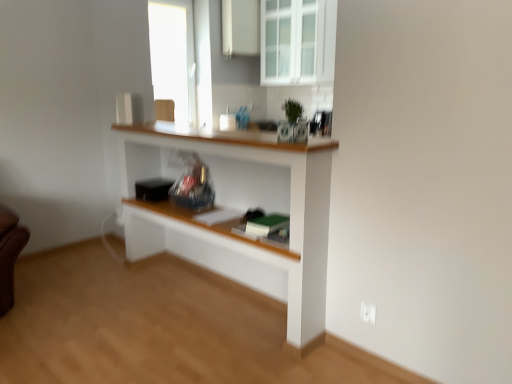
Question: Is point (364, 309) closer or farther from the camera than point (318, 145)?

Choices:
 (A) farther
 (B) closer

Answer: (A)

Question: Is white plastic electric outlet at lower right inside the boundaries of white wood shelf at center, or outside?

Choices:
 (A) outside
 (B) inside

Answer: (A)

Question: Considering the real-world distances, which object is farthest from the white plastic electric outlet at lower right?

Choices:
 (A) white wood shelf at center
 (B) white glass cabinet at upper center
 (C) white glossy cabinet at upper center

Answer: (C)

Question: Which is nearer to the white glass cabinet at upper center?

Choices:
 (A) white plastic electric outlet at lower right
 (B) white wood shelf at center
 (C) white glossy cabinet at upper center

Answer: (C)